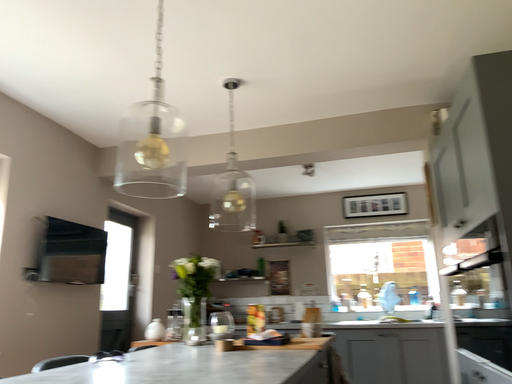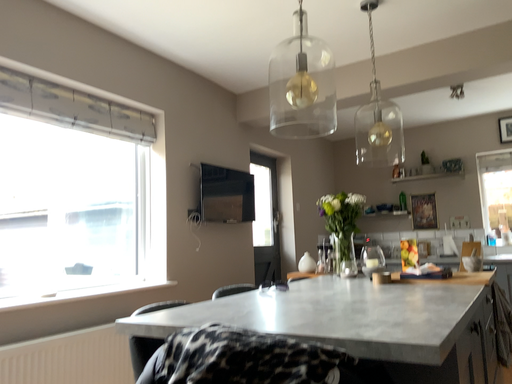
Question: Which way did the camera rotate in the video?

Choices:
 (A) rotated right
 (B) rotated left

Answer: (B)